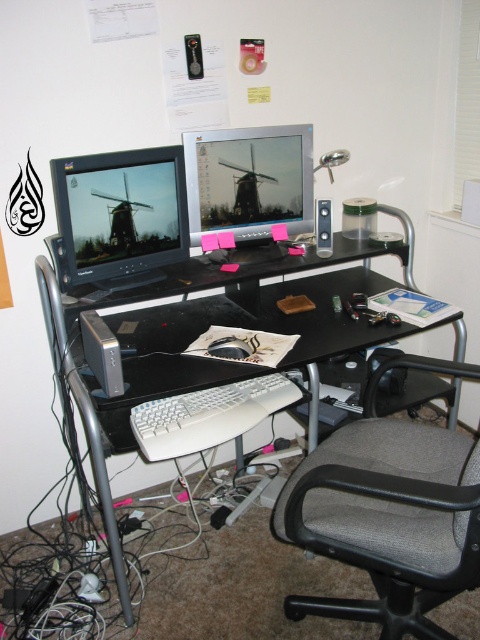
Question: Which point is farther to the camera?

Choices:
 (A) (303, 182)
 (B) (305, 513)
 (C) (339, 321)

Answer: (A)

Question: Estimate the real-world distances between objects in this image. Which object is closer to the black plastic desk at center?

Choices:
 (A) gray fabric swivel chair at lower right
 (B) matte plastic monitor at center
 (C) matte black monitor at left

Answer: (C)

Question: Does matte plastic monitor at center appear over white plastic keyboard at center?

Choices:
 (A) no
 (B) yes

Answer: (B)

Question: Does gray fabric swivel chair at lower right have a lesser width compared to matte plastic monitor at center?

Choices:
 (A) no
 (B) yes

Answer: (A)

Question: Which object is closer to the camera taking this photo?

Choices:
 (A) white plastic keyboard at center
 (B) matte plastic monitor at center
 (C) gray fabric swivel chair at lower right

Answer: (C)

Question: From the image, what is the correct spatial relationship of gray fabric swivel chair at lower right in relation to white plastic keyboard at center?

Choices:
 (A) above
 (B) below

Answer: (B)